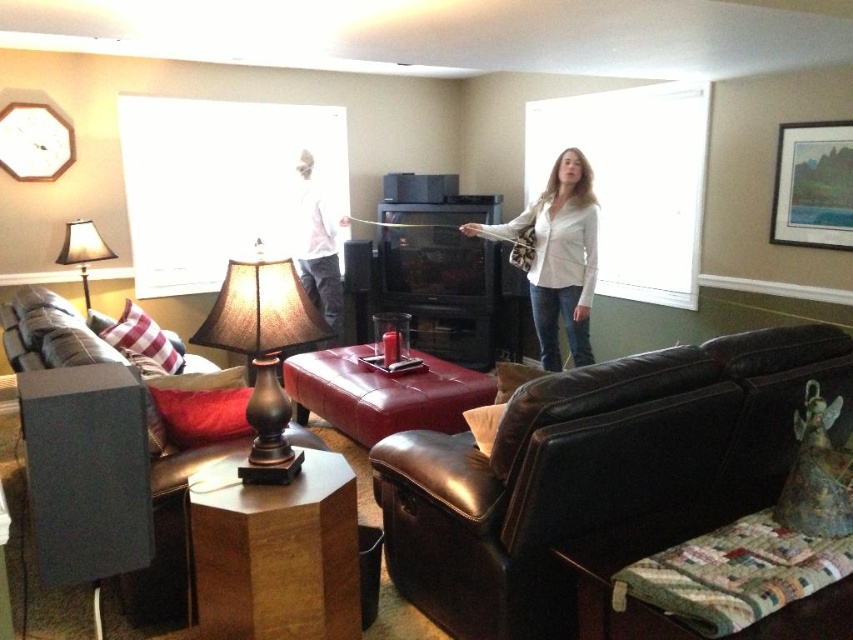
Is matte brown lamp at center shorter than leather ottoman at center?

Incorrect, matte brown lamp at center's height does not fall short of leather ottoman at center's.

Measure the distance from matte brown lamp at center to leather ottoman at center.

A distance of 1.59 meters exists between matte brown lamp at center and leather ottoman at center.

Who is more forward, (296, 346) or (363, 369)?

Point (296, 346)

At what (x,y) coordinates should I click in order to perform the action: click on matte brown lamp at center. Please return your answer as a coordinate pair (x, y). This screenshot has width=853, height=640. Looking at the image, I should click on (263, 352).

Between leather couch at lower left and white matte shirt at center, which one appears on the left side from the viewer's perspective?

leather couch at lower left is more to the left.

Does leather couch at lower left come in front of white matte shirt at center?

Yes, it is in front of white matte shirt at center.

Where is `leather couch at lower left`? The height and width of the screenshot is (640, 853). leather couch at lower left is located at coordinates (163, 544).

Between leather couch at lower left and matte brown lamp at center, which one appears on the left side from the viewer's perspective?

Positioned to the left is leather couch at lower left.

What do you see at coordinates (163, 544) in the screenshot? The width and height of the screenshot is (853, 640). I see `leather couch at lower left` at bounding box center [163, 544].

What do you see at coordinates (163, 544) in the screenshot?
I see `leather couch at lower left` at bounding box center [163, 544].

You are a GUI agent. You are given a task and a screenshot of the screen. Output one action in this format:
    pyautogui.click(x=<x>, y=<y>)
    Task: Click on the leather couch at lower left
    
    Given the screenshot: What is the action you would take?
    pyautogui.click(x=163, y=544)